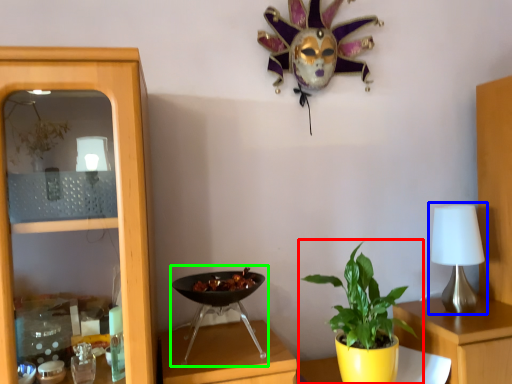
Question: Considering the real-world distances, which object is closest to houseplant (highlighted by a red box)? table lamp (highlighted by a blue box) or wok (highlighted by a green box).

Choices:
 (A) table lamp
 (B) wok

Answer: (B)